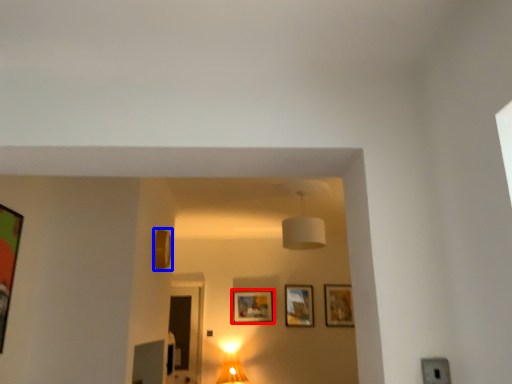
Question: Which object is closer to the camera taking this photo, picture frame (highlighted by a red box) or picture frame (highlighted by a blue box)?

Choices:
 (A) picture frame
 (B) picture frame

Answer: (B)